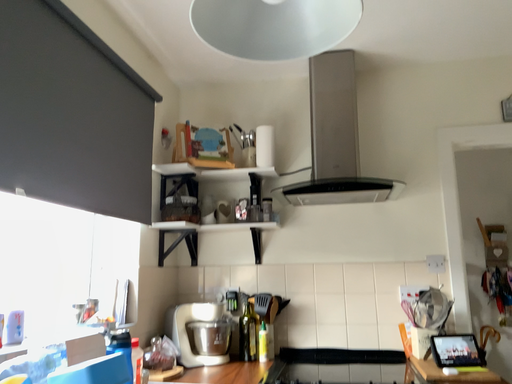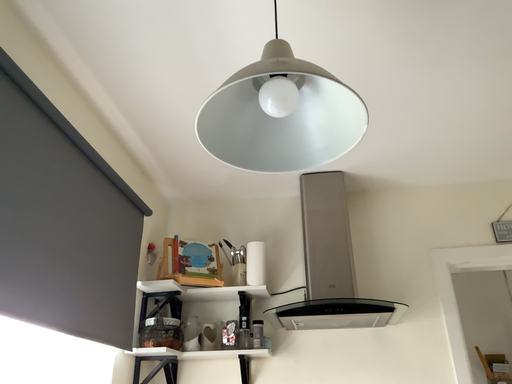
Question: Which way did the camera rotate in the video?

Choices:
 (A) rotated upward
 (B) rotated downward

Answer: (A)